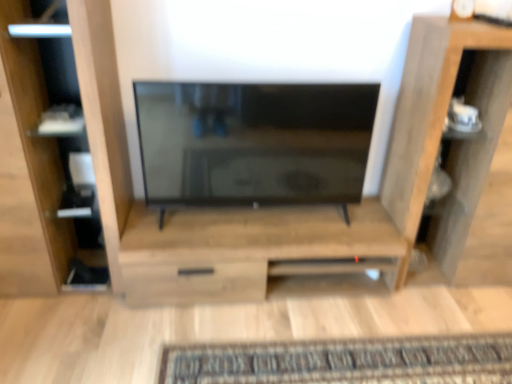
Question: Is wooden cabinet at center in front of or behind wooden shelf at right in the image?

Choices:
 (A) behind
 (B) front

Answer: (A)

Question: Based on their sizes in the image, would you say wooden cabinet at center is bigger or smaller than wooden shelf at right?

Choices:
 (A) big
 (B) small

Answer: (B)

Question: Estimate the real-world distances between objects in this image. Which object is farther from the wooden cabinet at center?

Choices:
 (A) wooden shelf at right
 (B) matte black tv at center
 (C) matte wood shelf at left

Answer: (A)

Question: Which object is positioned farthest from the wooden cabinet at center?

Choices:
 (A) wooden shelf at right
 (B) matte wood shelf at left
 (C) matte black tv at center

Answer: (A)